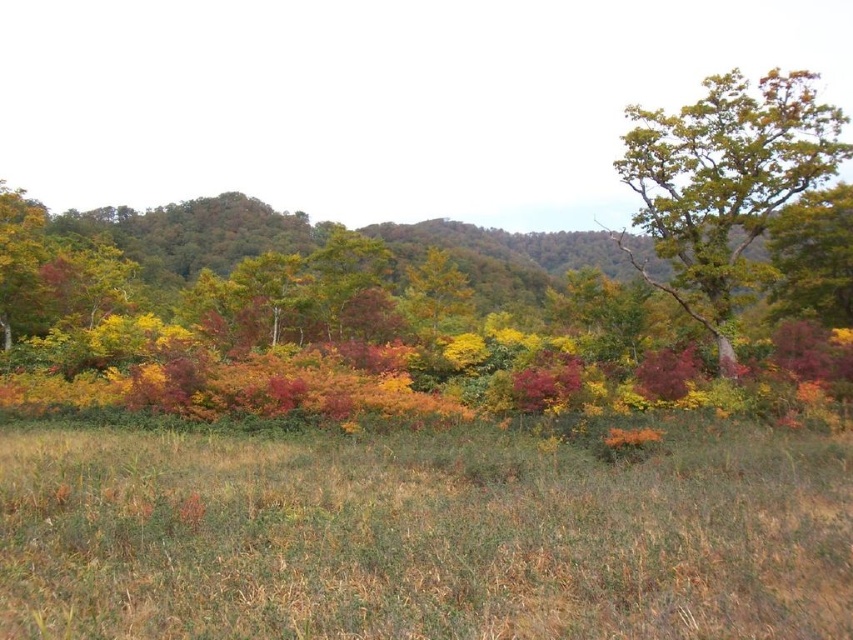
You are a hiker who wants to take a photo of the green leafy tree at upper right. You are currently standing on the brown dry grass at center. Which direction should you move to get a better view of the tree?

To get a better view of the green leafy tree at upper right, you should move away from the brown dry grass at center since it is shorter than the tree and might block your view.

You are standing in the autumn landscape and want to walk from the point closer to you to the farther point. Which path should you take between the two points, point (820,632) and point (663,225)?

You should walk from point (820,632) to point (663,225) because point (820,632) is closer to the camera and the other is farther away.